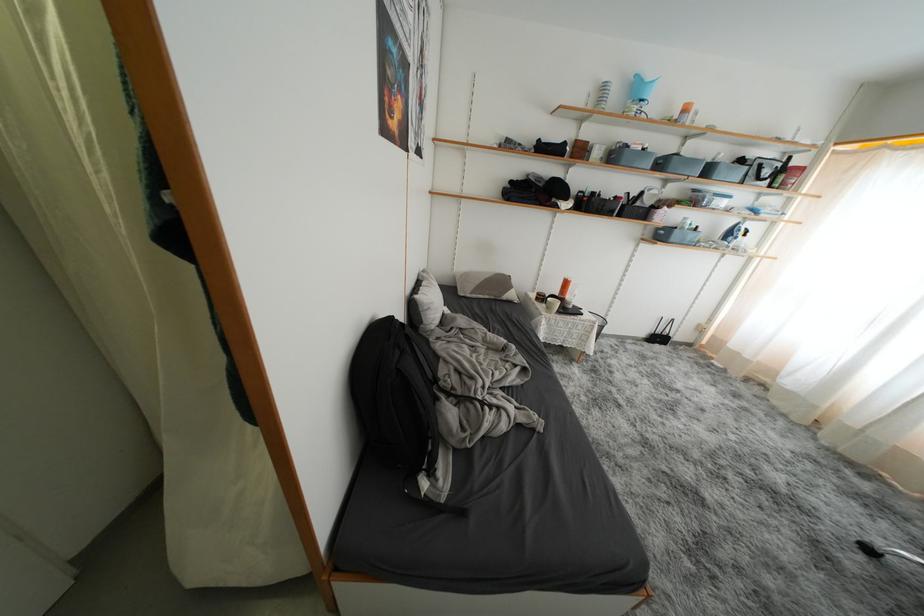
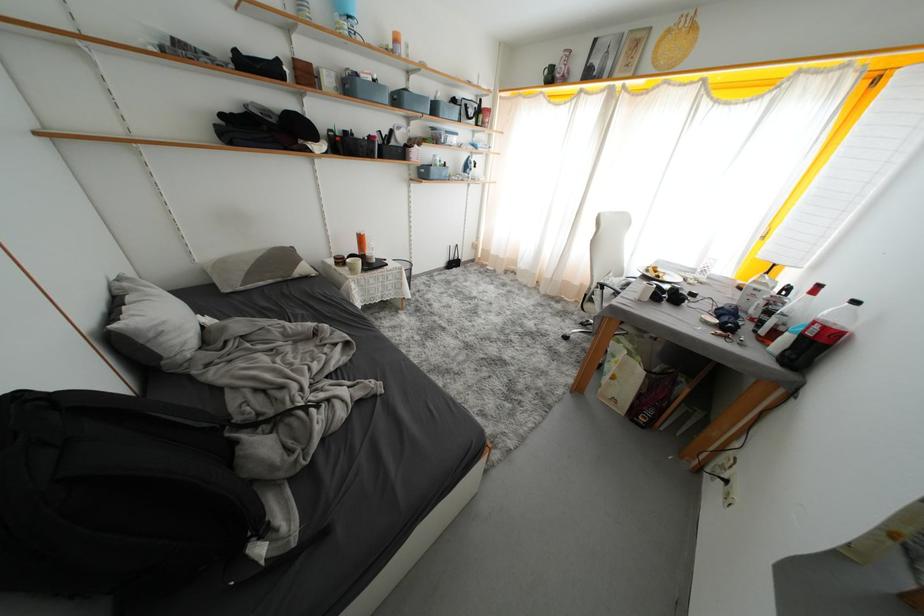
The point at (x=650, y=153) is marked in the first image. Where is the corresponding point in the second image?

(381, 84)